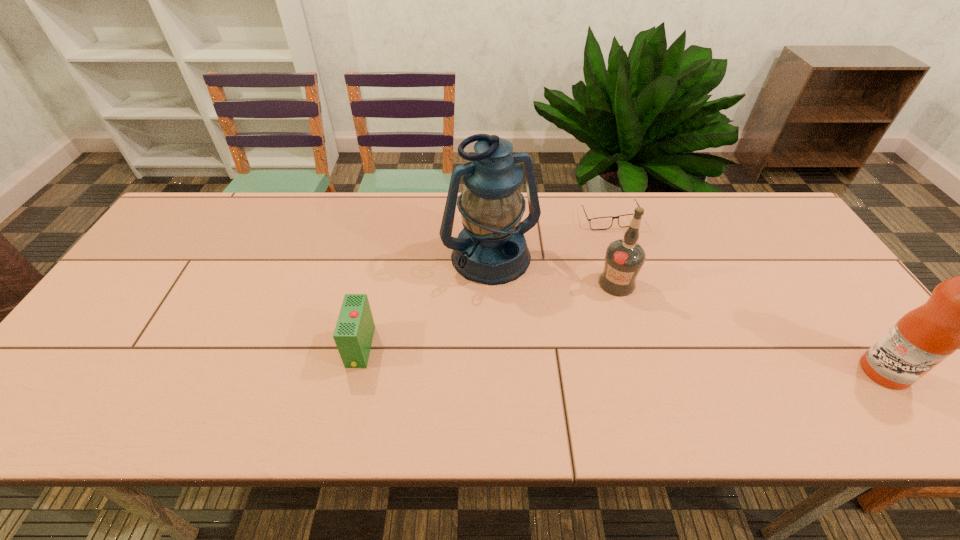
Find the location of a particular element. The image size is (960, 540). vacant area that lies between the fruit juice and the shortest object is located at coordinates (747, 295).

What are the coordinates of `free space between the third shortest object and the lantern` in the screenshot? It's located at (554, 272).

Identify the location of free area in between the vodka and the fruit juice. (751, 327).

Identify which object is located as the fourth nearest to the second object from left to right. Please provide its 2D coordinates. Your answer should be formatted as a tuple, i.e. [(x, y)], where the tuple contains the x and y coordinates of a point satisfying the conditions above.

[(959, 313)]

Locate an element on the screen. The height and width of the screenshot is (540, 960). the closest object relative to the leftmost object is located at coordinates (491, 249).